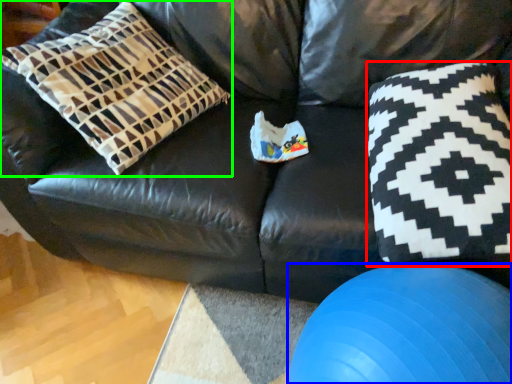
Question: Which object is the farthest from throw pillow (highlighted by a red box)? Choose among these: ball (highlighted by a blue box) or pillow (highlighted by a green box).

Choices:
 (A) ball
 (B) pillow

Answer: (B)